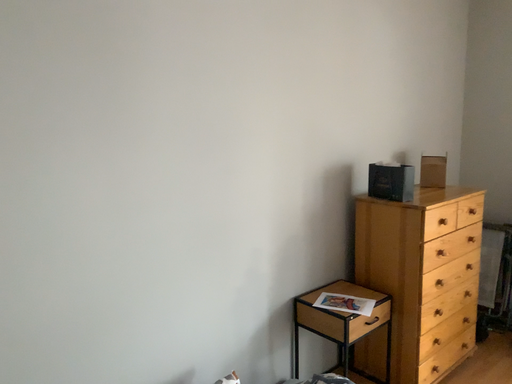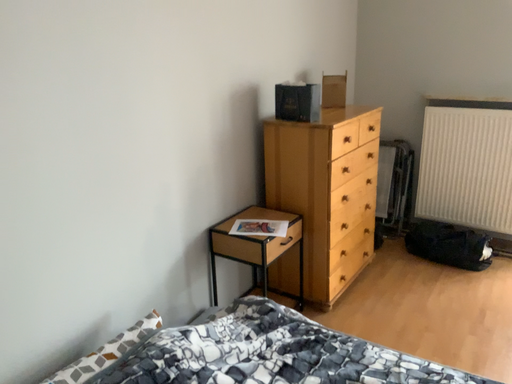
Question: How did the camera likely rotate when shooting the video?

Choices:
 (A) rotated downward
 (B) rotated upward

Answer: (A)